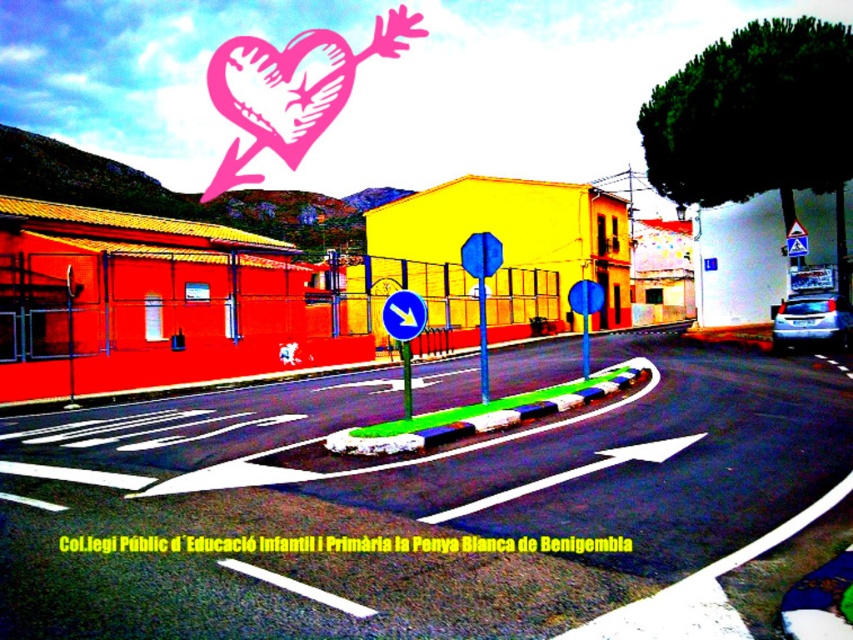
Measure the distance between pink paper heart at upper center and camera.

They are 31.22 meters apart.

Who is shorter, pink paper heart at upper center or blue plastic traffic sign at center?

blue plastic traffic sign at center

This screenshot has height=640, width=853. Find the location of `pink paper heart at upper center`. pink paper heart at upper center is located at coordinates (289, 90).

The image size is (853, 640). What are the coordinates of `pink paper heart at upper center` in the screenshot? It's located at (289, 90).